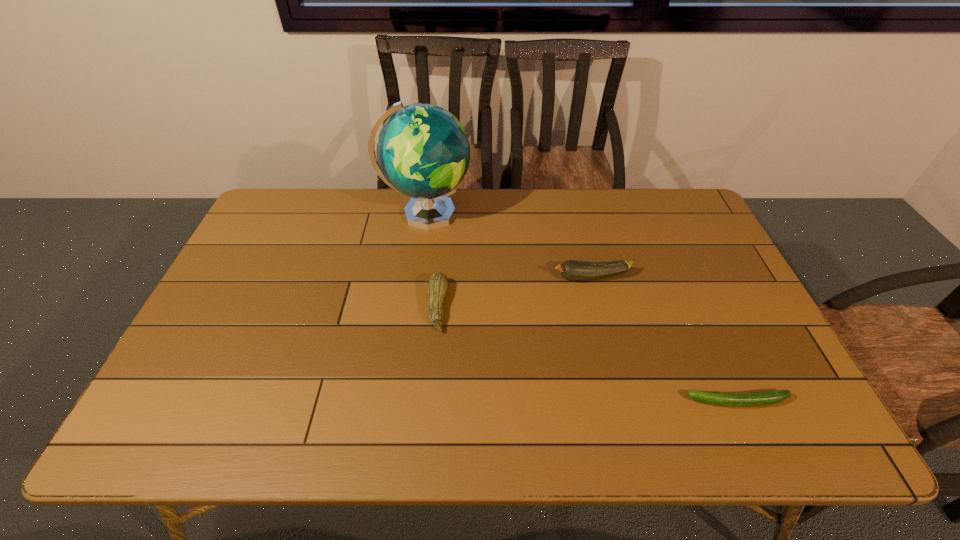
Where is `vacant space at the left edge`? This screenshot has height=540, width=960. vacant space at the left edge is located at coordinates (218, 364).

The image size is (960, 540). In the image, there is a desktop. Find the location of `vacant space at the far left corner`. vacant space at the far left corner is located at coordinates (288, 226).

Find the location of a particular element. free space between the third object from left to right and the tallest object is located at coordinates (509, 246).

The width and height of the screenshot is (960, 540). Find the location of `free space between the rightmost object and the leftmost zucchini`. free space between the rightmost object and the leftmost zucchini is located at coordinates (588, 354).

Find the location of a particular element. vacant space in between the shortest zucchini and the tallest object is located at coordinates (582, 308).

Locate an element on the screen. Image resolution: width=960 pixels, height=540 pixels. free spot between the tallest object and the third object from left to right is located at coordinates (509, 246).

Where is `free space that is in between the third object from left to right and the farthest object`? The height and width of the screenshot is (540, 960). free space that is in between the third object from left to right and the farthest object is located at coordinates (509, 246).

Identify the location of unoccupied area between the nearest object and the leftmost zucchini. [x=588, y=354].

This screenshot has width=960, height=540. Identify the location of empty space between the farthest object and the nearest zucchini. (582, 308).

The height and width of the screenshot is (540, 960). I want to click on free space between the second zucchini from left to right and the farthest object, so click(509, 246).